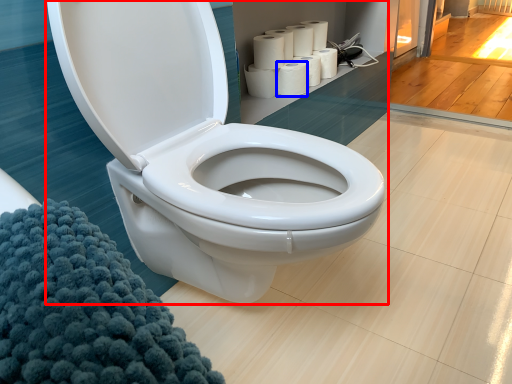
Question: Which object appears closest to the camera in this image, toilet (highlighted by a red box) or paper towel (highlighted by a blue box)?

Choices:
 (A) toilet
 (B) paper towel

Answer: (A)